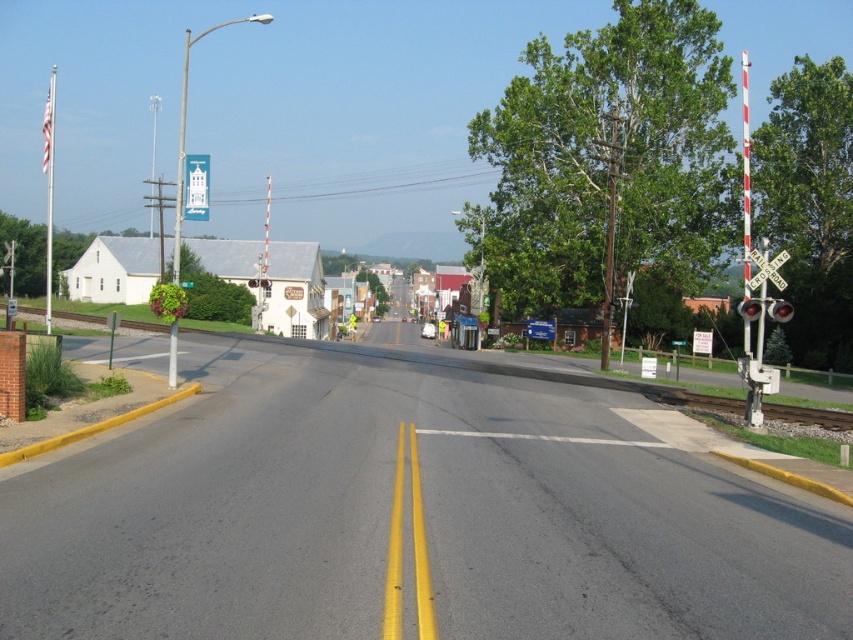
Question: From the image, what is the correct spatial relationship of white painted building at center in relation to metallic reflective railroad crossing sign at right?

Choices:
 (A) right
 (B) left

Answer: (B)

Question: Which point is farther to the camera?

Choices:
 (A) white painted building at center
 (B) metallic reflective railroad crossing sign at right

Answer: (A)

Question: Is white painted building at center wider than metallic reflective railroad crossing sign at right?

Choices:
 (A) yes
 (B) no

Answer: (A)

Question: Which point is farther to the camera?

Choices:
 (A) (756, 285)
 (B) (94, 269)

Answer: (B)

Question: Can you confirm if white painted building at center is positioned to the left of metallic reflective railroad crossing sign at right?

Choices:
 (A) yes
 (B) no

Answer: (A)